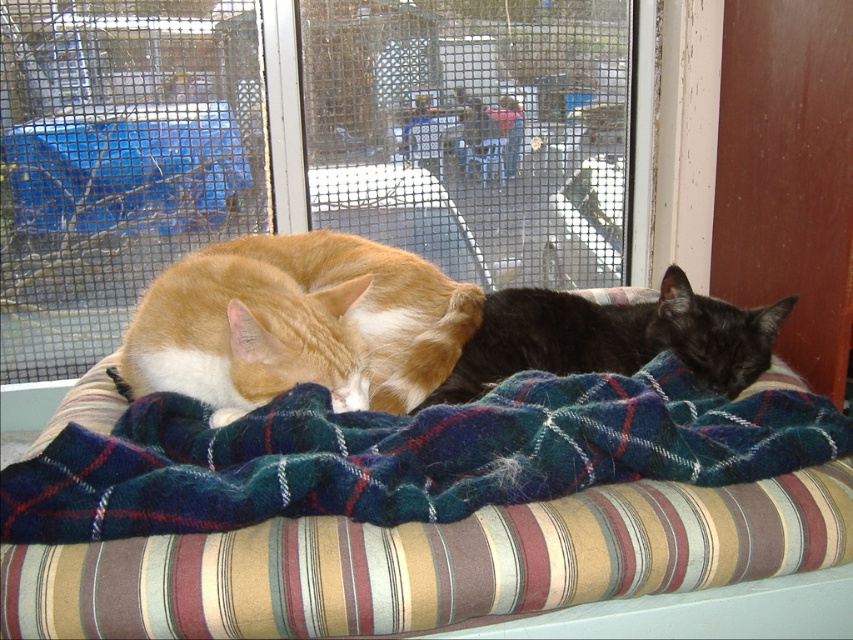
Is plaid woolen blanket at center bigger than black silky cat at center?

Indeed, plaid woolen blanket at center has a larger size compared to black silky cat at center.

Is point (106, 483) closer to viewer compared to point (567, 308)?

Yes, point (106, 483) is closer to viewer.

Locate an element on the screen. The image size is (853, 640). plaid woolen blanket at center is located at coordinates (405, 454).

Which is more to the right, clear glass window at center or brown wood screen door at upper right?

brown wood screen door at upper right is more to the right.

Looking at this image, who is positioned more to the left, clear glass window at center or brown wood screen door at upper right?

Positioned to the left is clear glass window at center.

Which is in front, point (49, 72) or point (730, 61)?

Point (730, 61) is more forward.

You are a GUI agent. You are given a task and a screenshot of the screen. Output one action in this format:
    pyautogui.click(x=<x>, y=<y>)
    Task: Click on the clear glass window at center
    The image size is (853, 640).
    Given the screenshot: What is the action you would take?
    pyautogui.click(x=120, y=161)

Between clear glass window at center and orange fur cat at center, which one is positioned lower?

Positioned lower is orange fur cat at center.

Does clear glass window at center appear on the left side of orange fur cat at center?

Correct, you'll find clear glass window at center to the left of orange fur cat at center.

Does point (567, 128) come closer to viewer compared to point (416, 339)?

No, it is not.

Identify the location of clear glass window at center. The image size is (853, 640). (120, 161).